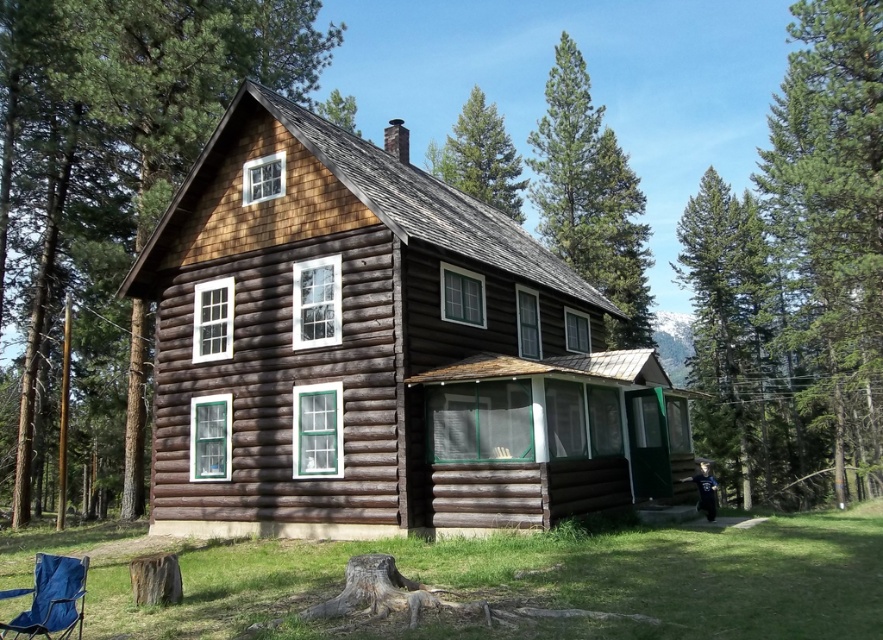
Can you confirm if green pine tree at upper center is bigger than blue fabric chair at lower left?

Yes, green pine tree at upper center is bigger than blue fabric chair at lower left.

In the scene shown: Who is positioned more to the right, green pine tree at upper center or blue fabric chair at lower left?

green pine tree at upper center

Between point (617, 173) and point (57, 582), which one is positioned in front?

Positioned in front is point (57, 582).

What are the coordinates of `green pine tree at upper center` in the screenshot? It's located at (590, 196).

Is point (331, 488) less distant than point (85, 572)?

No, it is behind (85, 572).

Can you confirm if wooden log cabin at center is smaller than blue fabric chair at lower left?

Incorrect, wooden log cabin at center is not smaller in size than blue fabric chair at lower left.

Is point (291, 396) in front of point (9, 589)?

No.

Where is `wooden log cabin at center`? The height and width of the screenshot is (640, 883). wooden log cabin at center is located at coordinates (378, 349).

The width and height of the screenshot is (883, 640). Find the location of `green coniferous tree at right`. green coniferous tree at right is located at coordinates (832, 216).

Is green coniferous tree at right to the left of green pine tree at upper center from the viewer's perspective?

Incorrect, green coniferous tree at right is not on the left side of green pine tree at upper center.

Who is more distant from viewer, (817, 244) or (540, 180)?

The point (540, 180) is more distant.

Locate an element on the screen. green coniferous tree at right is located at coordinates (832, 216).